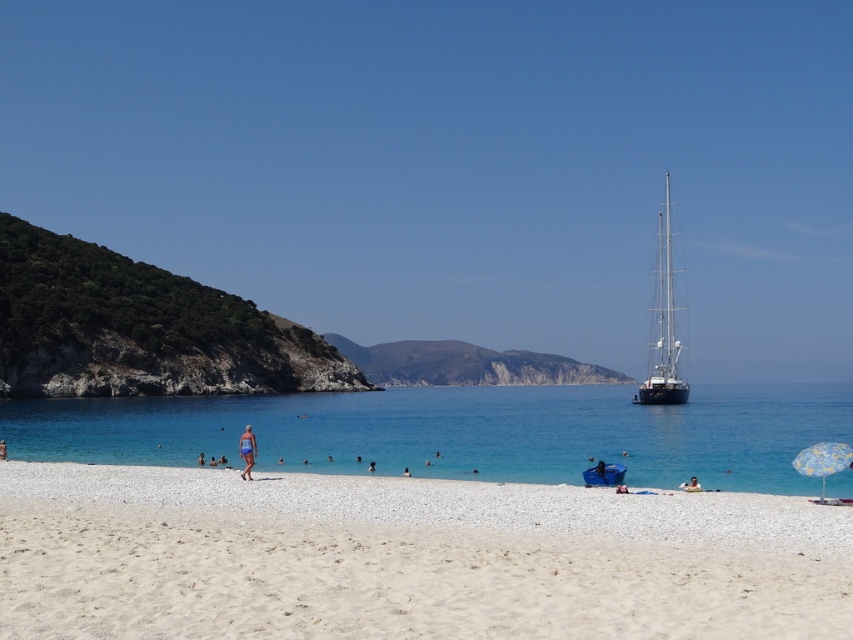
Does yellow floral fabric umbrella at lower right come behind blue fabric swimsuit at center?

No, yellow floral fabric umbrella at lower right is closer to the viewer.

Does yellow floral fabric umbrella at lower right have a lesser width compared to blue fabric swimsuit at center?

In fact, yellow floral fabric umbrella at lower right might be wider than blue fabric swimsuit at center.

This screenshot has width=853, height=640. In order to click on yellow floral fabric umbrella at lower right in this screenshot , I will do `click(822, 460)`.

This screenshot has width=853, height=640. What are the coordinates of `yellow floral fabric umbrella at lower right` in the screenshot? It's located at (822, 460).

Between clear blue water at center and blue matte surfboard at lower center, which one has less height?

Standing shorter between the two is blue matte surfboard at lower center.

The image size is (853, 640). Identify the location of clear blue water at center. [x=457, y=433].

I want to click on clear blue water at center, so tap(457, 433).

Image resolution: width=853 pixels, height=640 pixels. Find the location of `clear blue water at center`. clear blue water at center is located at coordinates coord(457,433).

Between clear blue water at center and blue fabric towel at lower center, which one appears on the right side from the viewer's perspective?

clear blue water at center

Can you confirm if clear blue water at center is taller than blue fabric towel at lower center?

Yes, clear blue water at center is taller than blue fabric towel at lower center.

This screenshot has height=640, width=853. What are the coordinates of `clear blue water at center` in the screenshot? It's located at (457, 433).

Locate an element on the screen. This screenshot has height=640, width=853. clear blue water at center is located at coordinates (457, 433).